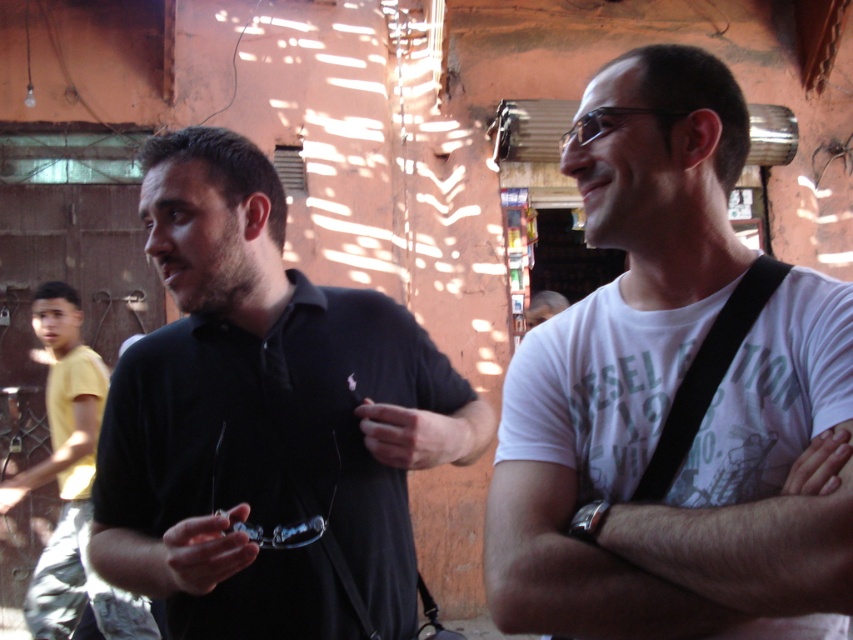
Question: Is white matte t-shirt at center wider than yellow cotton shirt at left?

Choices:
 (A) yes
 (B) no

Answer: (B)

Question: Does black matte shirt at left have a lesser width compared to white matte t-shirt at center?

Choices:
 (A) no
 (B) yes

Answer: (A)

Question: Which object is the closest to the yellow cotton shirt at left?

Choices:
 (A) black matte shirt at left
 (B) white matte t-shirt at center

Answer: (A)

Question: Which point appears closest to the camera in this image?

Choices:
 (A) (321, 460)
 (B) (76, 602)

Answer: (A)

Question: Is white matte t-shirt at center above yellow cotton shirt at left?

Choices:
 (A) no
 (B) yes

Answer: (B)

Question: Which is nearer to the yellow cotton shirt at left?

Choices:
 (A) white matte t-shirt at center
 (B) black matte shirt at left

Answer: (B)